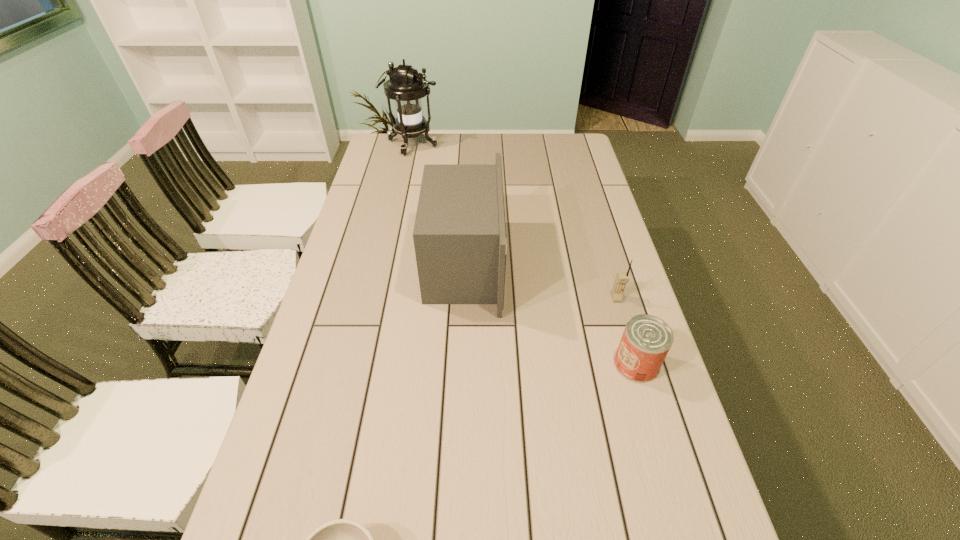
Locate an element on the screen. The width and height of the screenshot is (960, 540). free space located on the left of the second shortest object is located at coordinates (454, 364).

Where is `object situated at the far edge`? object situated at the far edge is located at coordinates (406, 86).

Identify the location of object that is at the left edge. (406, 86).

At what (x,y) coordinates should I click in order to perform the action: click on cellular telephone that is at the right edge. Please return your answer as a coordinate pair (x, y). This screenshot has width=960, height=540. Looking at the image, I should click on (622, 278).

The image size is (960, 540). I want to click on can situated at the right edge, so point(646,340).

Where is `object that is at the far left corner`? The height and width of the screenshot is (540, 960). object that is at the far left corner is located at coordinates (406, 86).

Locate an element on the screen. The image size is (960, 540). vacant space at the far edge of the desktop is located at coordinates (480, 148).

Where is `vacant space at the left edge`? Image resolution: width=960 pixels, height=540 pixels. vacant space at the left edge is located at coordinates (392, 234).

Locate an element on the screen. This screenshot has height=540, width=960. blank space at the right edge is located at coordinates (582, 167).

Where is `vacant space at the far right corner of the desktop`? This screenshot has height=540, width=960. vacant space at the far right corner of the desktop is located at coordinates (562, 153).